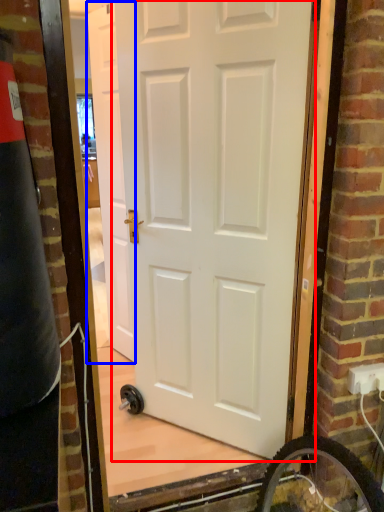
Question: Which object appears farthest to the camera in this image, door (highlighted by a red box) or door (highlighted by a blue box)?

Choices:
 (A) door
 (B) door

Answer: (B)